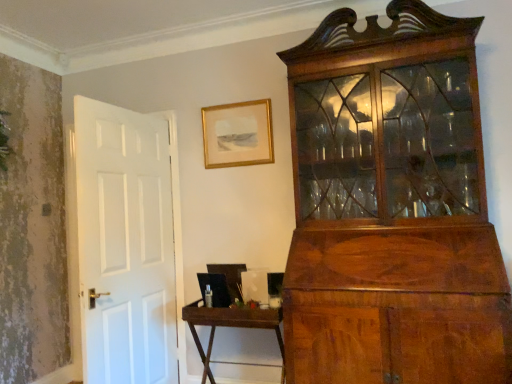
In order to face gold/glass picture frame at upper center, should I rotate leftwards or rightwards?

You should rotate left by 2.604 degrees.

Image resolution: width=512 pixels, height=384 pixels. Identify the location of gold/glass picture frame at upper center. (238, 134).

Consider the image. Measure the distance between point (248, 133) and camera.

Point (248, 133) and camera are 2.91 meters apart.

The width and height of the screenshot is (512, 384). Describe the element at coordinates (238, 134) in the screenshot. I see `gold/glass picture frame at upper center` at that location.

What do you see at coordinates (231, 326) in the screenshot? This screenshot has width=512, height=384. I see `brown wooden table at center` at bounding box center [231, 326].

You are a GUI agent. You are given a task and a screenshot of the screen. Output one action in this format:
    pyautogui.click(x=<x>, y=<y>)
    Task: Click on the brown wooden table at center
    The image size is (512, 384).
    Given the screenshot: What is the action you would take?
    pyautogui.click(x=231, y=326)

Find the location of a particular element. The width and height of the screenshot is (512, 384). gold/glass picture frame at upper center is located at coordinates coord(238,134).

Considering the relative positions of brown wooden table at center and gold/glass picture frame at upper center in the image provided, is brown wooden table at center to the left or to the right of gold/glass picture frame at upper center?

In the image, brown wooden table at center appears on the right side of gold/glass picture frame at upper center.

Considering their positions, is brown wooden table at center located in front of or behind gold/glass picture frame at upper center?

Clearly, brown wooden table at center is in front of gold/glass picture frame at upper center.

Which point is more forward, (x=230, y=310) or (x=272, y=145)?

Positioned in front is point (x=230, y=310).

From the image's perspective, is brown wooden table at center located above gold/glass picture frame at upper center?

No, from the image's perspective, brown wooden table at center is not on top of gold/glass picture frame at upper center.

From a real-world perspective, is brown wooden table at center above or below gold/glass picture frame at upper center?

brown wooden table at center is situated lower than gold/glass picture frame at upper center in the real world.

Can you confirm if brown wooden table at center is wider than gold/glass picture frame at upper center?

Indeed, brown wooden table at center has a greater width compared to gold/glass picture frame at upper center.

Does brown wooden table at center have a lesser height compared to gold/glass picture frame at upper center?

No.

Which of these two, brown wooden table at center or gold/glass picture frame at upper center, is smaller?

gold/glass picture frame at upper center is smaller.

Is brown wooden table at center completely or partially outside of gold/glass picture frame at upper center?

That's correct, brown wooden table at center is outside of gold/glass picture frame at upper center.

Is brown wooden table at center positioned far away from gold/glass picture frame at upper center?

Absolutely, brown wooden table at center is distant from gold/glass picture frame at upper center.

Could you tell me if brown wooden table at center is facing gold/glass picture frame at upper center?

No, brown wooden table at center does not turn towards gold/glass picture frame at upper center.

How distant is brown wooden table at center from gold/glass picture frame at upper center?

brown wooden table at center and gold/glass picture frame at upper center are 3.78 feet apart from each other.

This screenshot has width=512, height=384. Find the location of `table located on the right of gold/glass picture frame at upper center`. table located on the right of gold/glass picture frame at upper center is located at coordinates (231, 326).

Considering the relative positions of gold/glass picture frame at upper center and brown wooden table at center in the image provided, is gold/glass picture frame at upper center to the left of brown wooden table at center from the viewer's perspective?

Correct, you'll find gold/glass picture frame at upper center to the left of brown wooden table at center.

Between gold/glass picture frame at upper center and brown wooden table at center, which one is positioned in front?

Positioned in front is brown wooden table at center.

Is point (264, 139) closer to camera compared to point (229, 312)?

No.

From the image's perspective, between gold/glass picture frame at upper center and brown wooden table at center, which one is located above?

gold/glass picture frame at upper center, from the image's perspective.

Consider the image. From a real-world perspective, which is physically above, gold/glass picture frame at upper center or brown wooden table at center?

From a 3D spatial view, gold/glass picture frame at upper center is above.

Which object is thinner, gold/glass picture frame at upper center or brown wooden table at center?

gold/glass picture frame at upper center.

Who is taller, gold/glass picture frame at upper center or brown wooden table at center?

Standing taller between the two is brown wooden table at center.

Does gold/glass picture frame at upper center have a smaller size compared to brown wooden table at center?

Indeed, gold/glass picture frame at upper center has a smaller size compared to brown wooden table at center.

Could brown wooden table at center be considered to be inside gold/glass picture frame at upper center?

Actually, brown wooden table at center is outside gold/glass picture frame at upper center.

Is gold/glass picture frame at upper center beside brown wooden table at center?

No, gold/glass picture frame at upper center is not with brown wooden table at center.

Does gold/glass picture frame at upper center turn towards brown wooden table at center?

No, gold/glass picture frame at upper center is not aimed at brown wooden table at center.

Measure the distance between gold/glass picture frame at upper center and brown wooden table at center.

They are 3.78 feet apart.

Locate an element on the screen. picture frame that is above the brown wooden table at center (from the image's perspective) is located at coordinates (238, 134).

This screenshot has width=512, height=384. In order to click on table located below the gold/glass picture frame at upper center (from the image's perspective) in this screenshot , I will do `click(231, 326)`.

Find the location of a particular element. Image resolution: width=512 pixels, height=384 pixels. picture frame behind the brown wooden table at center is located at coordinates (238, 134).